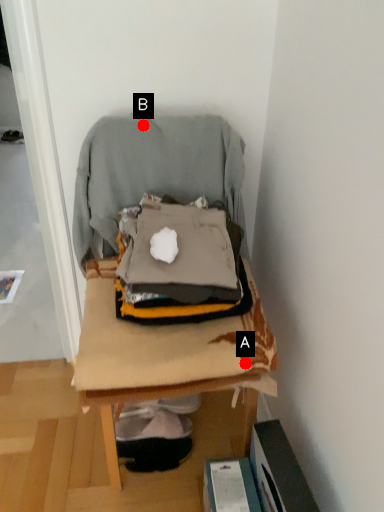
Question: Two points are circled on the image, labeled by A and B beside each circle. Among these points, which one is nearest to the camera?

Choices:
 (A) A is closer
 (B) B is closer

Answer: (A)